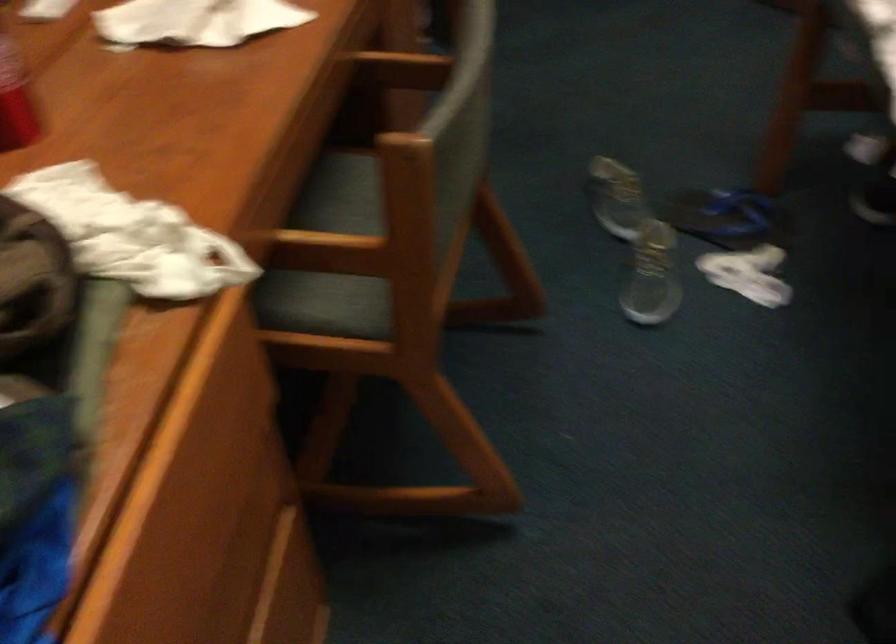
What do you see at coordinates (401, 69) in the screenshot? I see `the chair armrest` at bounding box center [401, 69].